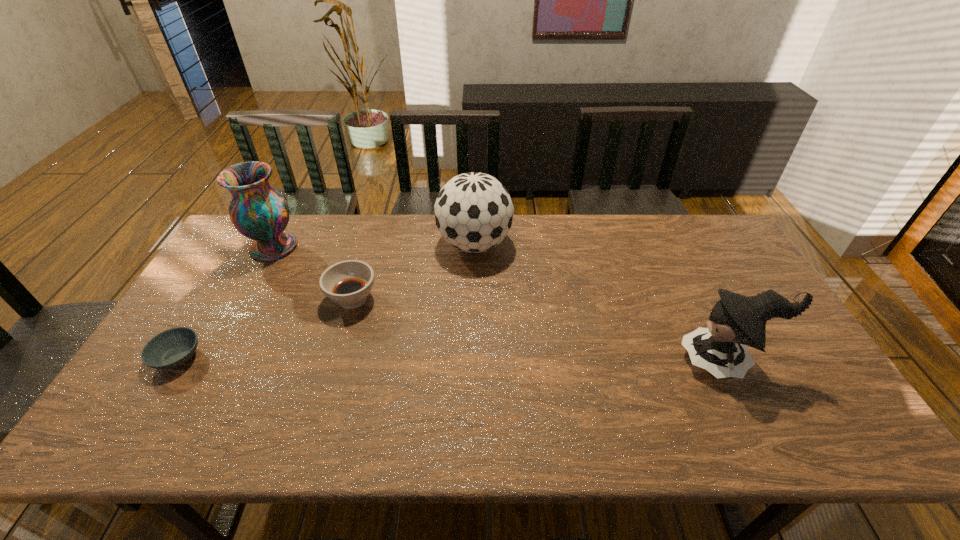
Locate an element on the screen. free region at the far edge is located at coordinates (403, 223).

At what (x,y) coordinates should I click in order to perform the action: click on blank space at the near edge. Please return your answer as a coordinate pair (x, y). The width and height of the screenshot is (960, 540). Looking at the image, I should click on (348, 434).

In the image, there is a desktop. At what (x,y) coordinates should I click in order to perform the action: click on free space at the left edge. Please return your answer as a coordinate pair (x, y). Image resolution: width=960 pixels, height=540 pixels. Looking at the image, I should click on (191, 392).

Where is `vacant space at the near left corner of the desktop`? vacant space at the near left corner of the desktop is located at coordinates (154, 443).

I want to click on vacant space in between the vase and the third nearest object, so click(313, 273).

What are the coordinates of `free space between the vase and the second shortest object` in the screenshot? It's located at (313, 273).

Locate an element on the screen. This screenshot has height=540, width=960. blank region between the second object from right to left and the vase is located at coordinates (374, 246).

What are the coordinates of `vacant area between the vase and the rightmost object` in the screenshot? It's located at (499, 304).

You are a GUI agent. You are given a task and a screenshot of the screen. Output one action in this format:
    pyautogui.click(x=<x>, y=<y>)
    Task: Click on the empty space that is in between the rightmost object and the third object from right to left
    The height and width of the screenshot is (540, 960).
    Given the screenshot: What is the action you would take?
    pyautogui.click(x=539, y=330)

The height and width of the screenshot is (540, 960). In order to click on vacant space that's between the nearer soup bowl and the right soup bowl in this screenshot , I will do `click(265, 328)`.